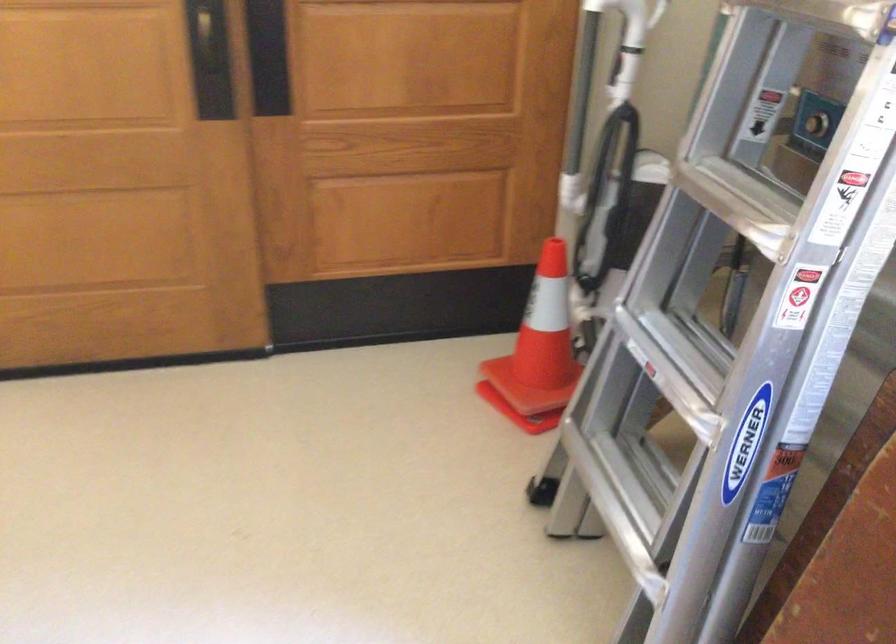
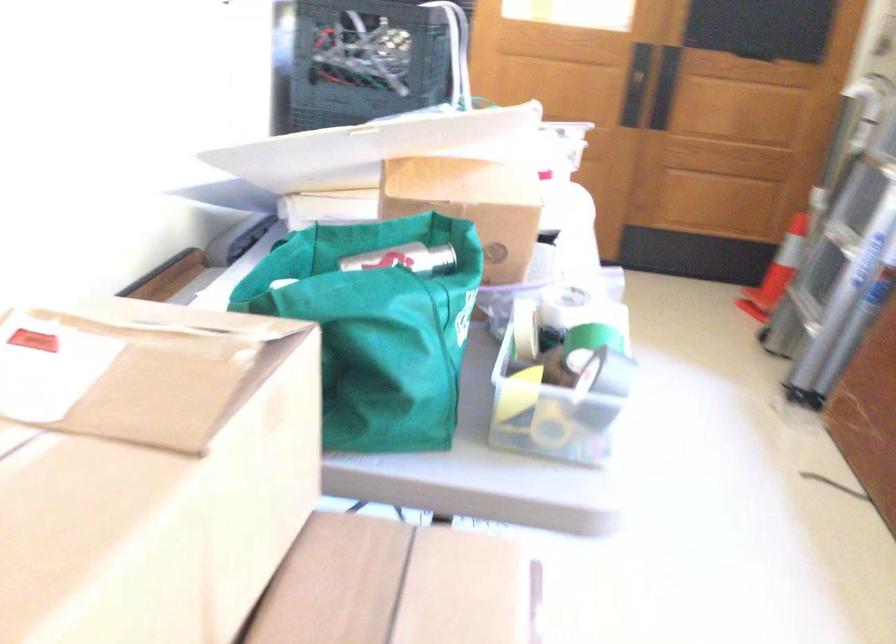
The point at (x=435, y=303) is marked in the first image. Where is the corresponding point in the second image?

(745, 237)